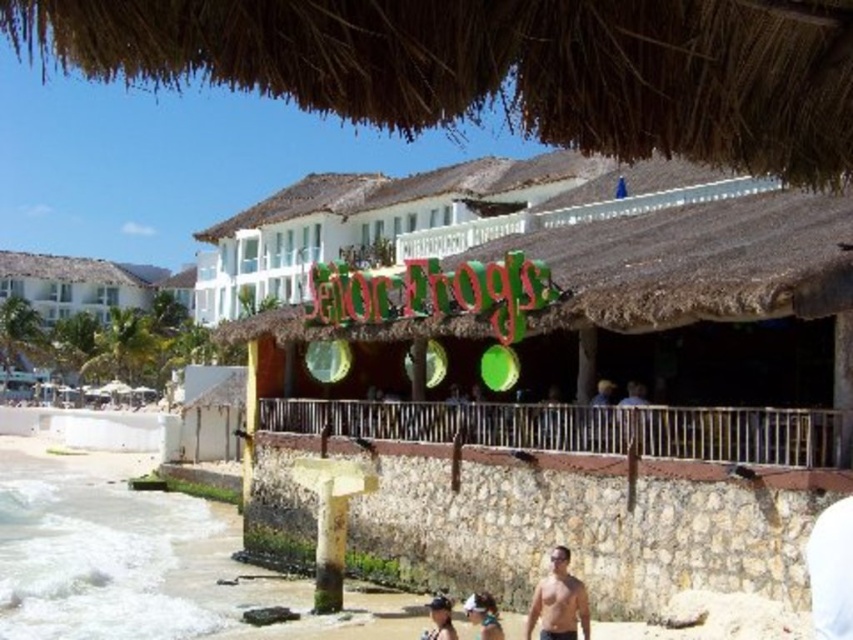
You are a photographer trying to capture a wide shot of the beach scene. You notice two people in the frame, the smooth skin torso at lower right and the smooth tan skin at center. Which person should you focus on if you want to highlight someone who takes up more space in the photo?

The smooth tan skin at center takes up more space in the photo because it has a greater width compared to the smooth skin torso at lower right.

You are a photographer at the beach and want to capture both the smooth skin torso at lower right and the smooth tan skin at center in a single frame. Which subject should you focus on first to ensure both are in the shot?

The smooth skin torso at lower right is shorter than the smooth tan skin at center, so you should focus on the smooth tan skin at center first to ensure both are in the shot.

You are standing at the entrance of the beachside establishment marked by the thatched roof and the sign reading Hog. You need to locate the smooth skin torso at lower right. According to the coordinates provided, where exactly is it positioned?

The smooth skin torso at lower right is located at point coordinates (558, 602).